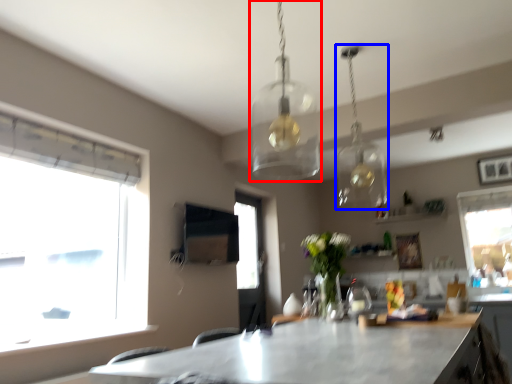
Question: Among these objects, which one is nearest to the camera, lamp (highlighted by a red box) or lamp (highlighted by a blue box)?

Choices:
 (A) lamp
 (B) lamp

Answer: (A)